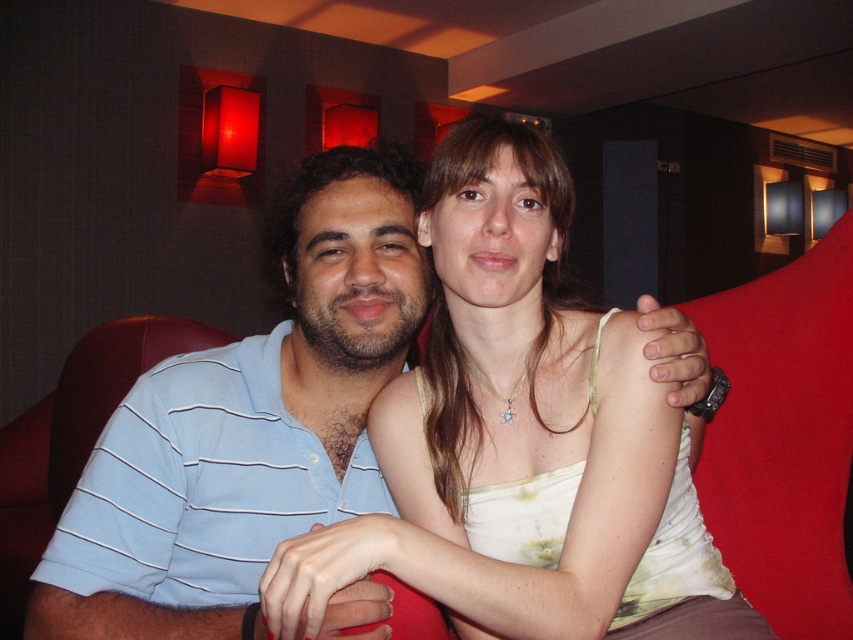
You are a fashion designer observing two people in a lounge setting. You notice the white cotton tank top at center and the blue striped polo shirt at left. Which clothing item has a greater width?

The white cotton tank top at center might be wider than blue striped polo shirt at left according to the description.

You are a photographer trying to capture the perfect shot of the scene. You want to focus on the white cotton tank top at center. Based on its position, where should you aim your camera to ensure it is centered in the frame?

To center the white cotton tank top at center in the frame, aim your camera at the coordinates point (515, 429), as that is the 2D location of the white cotton tank top at center.

You are designing a seating arrangement for a small event and want to ensure there is enough space between two chairs. The chairs will be placed where the white cotton tank top at center and blue striped polo shirt at left are currently positioned. Based on their positions, which chair should be placed closer to the front of the room to maintain proper spacing?

The white cotton tank top at center has a lesser height compared to the blue striped polo shirt at left. To maintain proper spacing, the chair for the white cotton tank top at center should be placed closer to the front since it is shorter, allowing for balanced visibility between both chairs.